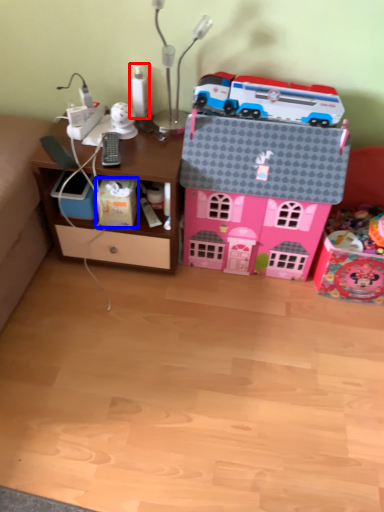
Question: Which of the following is the closest to the observer, toy (highlighted by a red box) or cardboard box (highlighted by a blue box)?

Choices:
 (A) toy
 (B) cardboard box

Answer: (B)